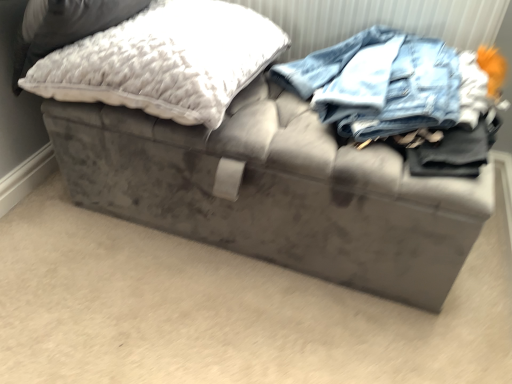
Where is `white fluffy pillow at upper left, positioned as the 1th pillow in left-to-right order`? This screenshot has height=384, width=512. white fluffy pillow at upper left, positioned as the 1th pillow in left-to-right order is located at coordinates (65, 26).

Consider the image. Measure the distance between white fluffy pillow at upper left, which is the second pillow in right-to-left order, and camera.

The distance of white fluffy pillow at upper left, which is the second pillow in right-to-left order, from camera is 32.05 inches.

Image resolution: width=512 pixels, height=384 pixels. Describe the element at coordinates (65, 26) in the screenshot. I see `white fluffy pillow at upper left, positioned as the 1th pillow in left-to-right order` at that location.

What is the approximate width of white fluffy pillow at upper left, which is counted as the 2th pillow, starting from the left?

white fluffy pillow at upper left, which is counted as the 2th pillow, starting from the left, is 20.80 inches wide.

This screenshot has width=512, height=384. Describe the element at coordinates (165, 61) in the screenshot. I see `white fluffy pillow at upper left, which is the 1th pillow from right to left` at that location.

Image resolution: width=512 pixels, height=384 pixels. In order to click on white fluffy pillow at upper left, which is the 1th pillow from right to left in this screenshot , I will do `click(165, 61)`.

The width and height of the screenshot is (512, 384). In order to click on white fluffy pillow at upper left, which is the second pillow in right-to-left order in this screenshot , I will do `click(65, 26)`.

Considering the relative positions of white fluffy pillow at upper left, which is the 1th pillow from right to left, and white fluffy pillow at upper left, positioned as the 1th pillow in left-to-right order, in the image provided, is white fluffy pillow at upper left, which is the 1th pillow from right to left, to the left or to the right of white fluffy pillow at upper left, positioned as the 1th pillow in left-to-right order,?

Based on their positions, white fluffy pillow at upper left, which is the 1th pillow from right to left, is located to the right of white fluffy pillow at upper left, positioned as the 1th pillow in left-to-right order.

Is white fluffy pillow at upper left, which is the 1th pillow from right to left, further to the viewer compared to white fluffy pillow at upper left, which is the second pillow in right-to-left order?

Yes, white fluffy pillow at upper left, which is the 1th pillow from right to left, is further from the viewer.

Is point (254, 68) behind point (56, 22)?

Yes, it is.

From the image's perspective, is white fluffy pillow at upper left, which is counted as the 2th pillow, starting from the left, under white fluffy pillow at upper left, which is the second pillow in right-to-left order?

Yes, from the image's perspective, white fluffy pillow at upper left, which is counted as the 2th pillow, starting from the left, is below white fluffy pillow at upper left, which is the second pillow in right-to-left order.

From a real-world perspective, is white fluffy pillow at upper left, which is the 1th pillow from right to left, positioned over white fluffy pillow at upper left, positioned as the 1th pillow in left-to-right order, based on gravity?

Incorrect, from a real-world perspective, white fluffy pillow at upper left, which is the 1th pillow from right to left, is lower than white fluffy pillow at upper left, positioned as the 1th pillow in left-to-right order.

Is white fluffy pillow at upper left, which is counted as the 2th pillow, starting from the left, wider than white fluffy pillow at upper left, which is the second pillow in right-to-left order?

No.

Considering the relative sizes of white fluffy pillow at upper left, which is the 1th pillow from right to left, and white fluffy pillow at upper left, which is the second pillow in right-to-left order, in the image provided, is white fluffy pillow at upper left, which is the 1th pillow from right to left, taller than white fluffy pillow at upper left, which is the second pillow in right-to-left order,?

Correct, white fluffy pillow at upper left, which is the 1th pillow from right to left, is much taller as white fluffy pillow at upper left, which is the second pillow in right-to-left order.

Considering the sizes of objects white fluffy pillow at upper left, which is counted as the 2th pillow, starting from the left, and white fluffy pillow at upper left, which is the second pillow in right-to-left order, in the image provided, who is smaller, white fluffy pillow at upper left, which is counted as the 2th pillow, starting from the left, or white fluffy pillow at upper left, which is the second pillow in right-to-left order,?

Smaller between the two is white fluffy pillow at upper left, which is the second pillow in right-to-left order.

Can we say white fluffy pillow at upper left, which is counted as the 2th pillow, starting from the left, lies outside white fluffy pillow at upper left, which is the second pillow in right-to-left order?

Yes, white fluffy pillow at upper left, which is counted as the 2th pillow, starting from the left, is located beyond the bounds of white fluffy pillow at upper left, which is the second pillow in right-to-left order.

From the picture: Would you say white fluffy pillow at upper left, which is the 1th pillow from right to left, is a long distance from white fluffy pillow at upper left, which is the second pillow in right-to-left order?

They are positioned close to each other.

Is white fluffy pillow at upper left, which is counted as the 2th pillow, starting from the left, aimed at white fluffy pillow at upper left, which is the second pillow in right-to-left order?

No, white fluffy pillow at upper left, which is counted as the 2th pillow, starting from the left, is not oriented towards white fluffy pillow at upper left, which is the second pillow in right-to-left order.

What's the angular difference between white fluffy pillow at upper left, which is counted as the 2th pillow, starting from the left, and white fluffy pillow at upper left, which is the second pillow in right-to-left order,'s facing directions?

The angle between the facing direction of white fluffy pillow at upper left, which is counted as the 2th pillow, starting from the left, and the facing direction of white fluffy pillow at upper left, which is the second pillow in right-to-left order, is 6.08 degrees.

Locate an element on the screen. pillow to the right of white fluffy pillow at upper left, positioned as the 1th pillow in left-to-right order is located at coordinates (165, 61).

Considering the relative positions of white fluffy pillow at upper left, positioned as the 1th pillow in left-to-right order, and white fluffy pillow at upper left, which is the 1th pillow from right to left, in the image provided, is white fluffy pillow at upper left, positioned as the 1th pillow in left-to-right order, to the right of white fluffy pillow at upper left, which is the 1th pillow from right to left, from the viewer's perspective?

No, white fluffy pillow at upper left, positioned as the 1th pillow in left-to-right order, is not to the right of white fluffy pillow at upper left, which is the 1th pillow from right to left.

Between white fluffy pillow at upper left, which is the second pillow in right-to-left order, and white fluffy pillow at upper left, which is counted as the 2th pillow, starting from the left, which one is positioned in front?

white fluffy pillow at upper left, which is the second pillow in right-to-left order, is closer to the camera.

Which point is more forward, (100,19) or (198,90)?

The point (198,90) is in front.

From the image's perspective, between white fluffy pillow at upper left, positioned as the 1th pillow in left-to-right order, and white fluffy pillow at upper left, which is the 1th pillow from right to left, who is located below?

white fluffy pillow at upper left, which is the 1th pillow from right to left, is shown below in the image.

From a real-world perspective, is white fluffy pillow at upper left, positioned as the 1th pillow in left-to-right order, positioned under white fluffy pillow at upper left, which is the 1th pillow from right to left, based on gravity?

Actually, white fluffy pillow at upper left, positioned as the 1th pillow in left-to-right order, is physically above white fluffy pillow at upper left, which is the 1th pillow from right to left, in the real world.

Does white fluffy pillow at upper left, which is the second pillow in right-to-left order, have a greater width compared to white fluffy pillow at upper left, which is the 1th pillow from right to left?

Correct, the width of white fluffy pillow at upper left, which is the second pillow in right-to-left order, exceeds that of white fluffy pillow at upper left, which is the 1th pillow from right to left.

Can you confirm if white fluffy pillow at upper left, which is the second pillow in right-to-left order, is taller than white fluffy pillow at upper left, which is the 1th pillow from right to left?

In fact, white fluffy pillow at upper left, which is the second pillow in right-to-left order, may be shorter than white fluffy pillow at upper left, which is the 1th pillow from right to left.

Which of these two, white fluffy pillow at upper left, positioned as the 1th pillow in left-to-right order, or white fluffy pillow at upper left, which is counted as the 2th pillow, starting from the left, is bigger?

With larger size is white fluffy pillow at upper left, which is counted as the 2th pillow, starting from the left.

Is white fluffy pillow at upper left, which is counted as the 2th pillow, starting from the left, a part of white fluffy pillow at upper left, positioned as the 1th pillow in left-to-right order?

No, white fluffy pillow at upper left, which is counted as the 2th pillow, starting from the left, is located outside of white fluffy pillow at upper left, positioned as the 1th pillow in left-to-right order.

Can you see white fluffy pillow at upper left, positioned as the 1th pillow in left-to-right order, touching white fluffy pillow at upper left, which is counted as the 2th pillow, starting from the left?

white fluffy pillow at upper left, positioned as the 1th pillow in left-to-right order, is not next to white fluffy pillow at upper left, which is counted as the 2th pillow, starting from the left, and they're not touching.

Is white fluffy pillow at upper left, positioned as the 1th pillow in left-to-right order, facing towards white fluffy pillow at upper left, which is the 1th pillow from right to left?

No, white fluffy pillow at upper left, positioned as the 1th pillow in left-to-right order, is not aimed at white fluffy pillow at upper left, which is the 1th pillow from right to left.

Where is `pillow located behind the white fluffy pillow at upper left, positioned as the 1th pillow in left-to-right order`? The image size is (512, 384). pillow located behind the white fluffy pillow at upper left, positioned as the 1th pillow in left-to-right order is located at coordinates (165, 61).

Where is `pillow on the left of the white fluffy pillow at upper left, which is counted as the 2th pillow, starting from the left`? pillow on the left of the white fluffy pillow at upper left, which is counted as the 2th pillow, starting from the left is located at coordinates (65, 26).

The image size is (512, 384). Find the location of `pillow to the right of white fluffy pillow at upper left, which is the second pillow in right-to-left order`. pillow to the right of white fluffy pillow at upper left, which is the second pillow in right-to-left order is located at coordinates click(x=165, y=61).